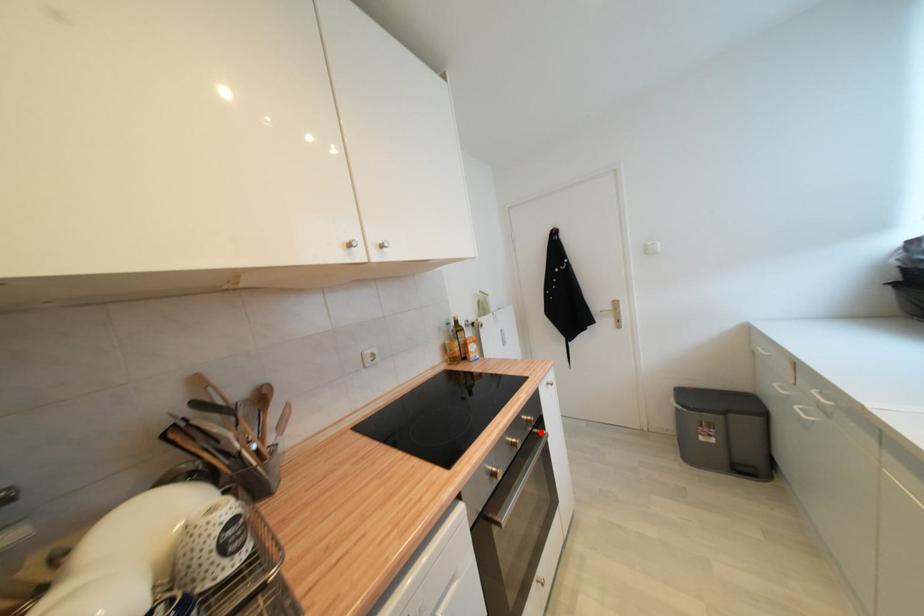
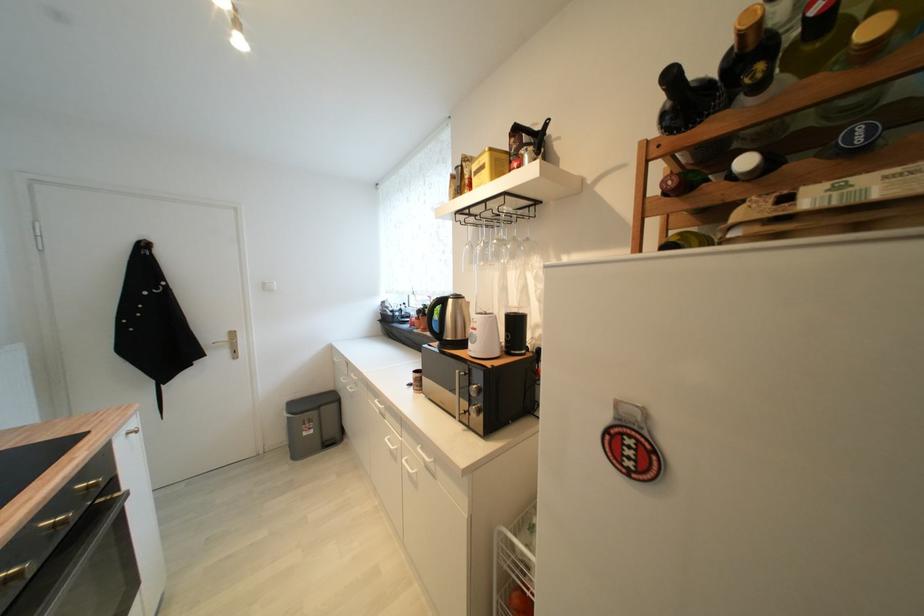
The point at the highlighted location is marked in the first image. Where is the corresponding point in the second image?

(107, 503)